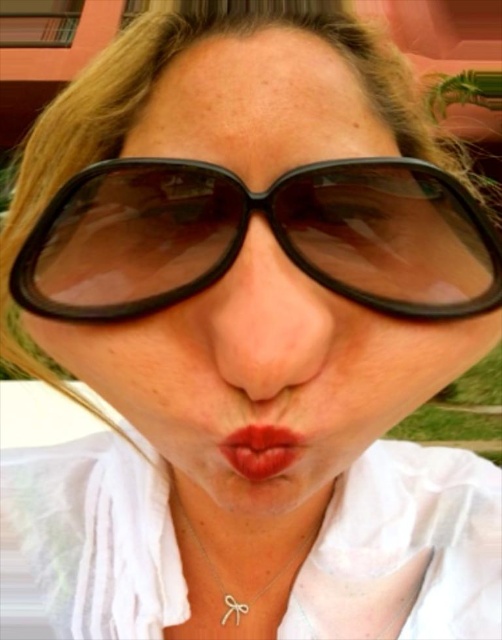
Can you confirm if smooth flesh nose at center is bigger than silver metallic bow at center?

Incorrect, smooth flesh nose at center is not larger than silver metallic bow at center.

Between smooth flesh nose at center and silver metallic bow at center, which one has more height?

With more height is silver metallic bow at center.

This screenshot has width=502, height=640. Identify the location of smooth flesh nose at center. (266, 323).

Can you confirm if black plastic sunglasses at center is shorter than shiny red lips at center?

No, black plastic sunglasses at center is not shorter than shiny red lips at center.

Is black plastic sunglasses at center below shiny red lips at center?

Incorrect, black plastic sunglasses at center is not positioned below shiny red lips at center.

This screenshot has width=502, height=640. What do you see at coordinates (245, 230) in the screenshot? I see `black plastic sunglasses at center` at bounding box center [245, 230].

The image size is (502, 640). What are the coordinates of `black plastic sunglasses at center` in the screenshot? It's located at (245, 230).

Which is above, smooth flesh nose at center or shiny red lips at center?

Positioned higher is smooth flesh nose at center.

Can you confirm if smooth flesh nose at center is thinner than shiny red lips at center?

No, smooth flesh nose at center is not thinner than shiny red lips at center.

You are a GUI agent. You are given a task and a screenshot of the screen. Output one action in this format:
    pyautogui.click(x=<x>, y=<y>)
    Task: Click on the smooth flesh nose at center
    The image size is (502, 640).
    Given the screenshot: What is the action you would take?
    pyautogui.click(x=266, y=323)

Identify the location of smooth flesh nose at center. The image size is (502, 640). (266, 323).